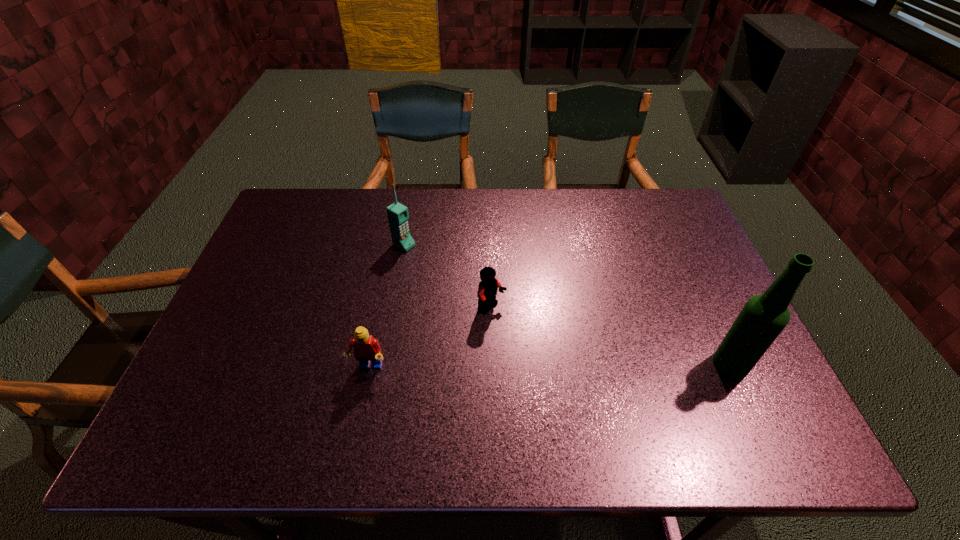
You are a GUI agent. You are given a task and a screenshot of the screen. Output one action in this format:
    pyautogui.click(x=<x>, y=<y>)
    Task: Click on the free space on the desktop that is between the nearer Lego and the beer bottle and is positioned on the keypad of the cellular telephone
    
    Given the screenshot: What is the action you would take?
    pyautogui.click(x=601, y=366)

In order to click on vacant spot on the desktop that is between the left Lego and the tallest object and is positioned on the front-facing side of the farther Lego in this screenshot , I will do `click(566, 366)`.